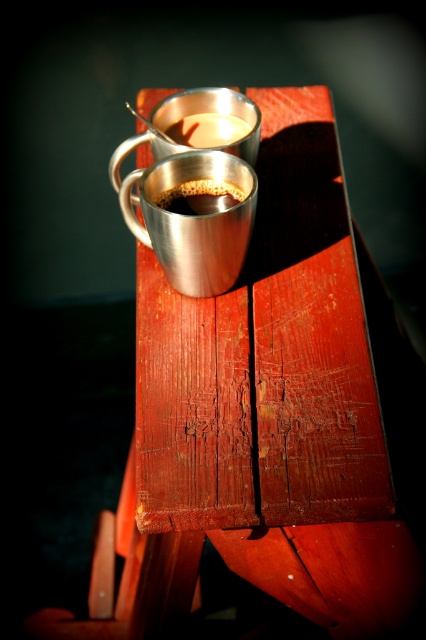
Question: Among these points, which one is nearest to the camera?

Choices:
 (A) (219, 218)
 (B) (222, 131)
 (C) (299, 467)
 (D) (178, 189)

Answer: (C)

Question: Does metallic silver cup at upper center appear on the right side of shiny metallic cup at center?

Choices:
 (A) yes
 (B) no

Answer: (A)

Question: Which point appears farthest from the camera in this image?

Choices:
 (A) (192, 124)
 (B) (164, 248)
 (C) (184, 192)
 (D) (143, 435)

Answer: (A)

Question: Is shiny metallic mug at center smaller than shiny metallic cup at center?

Choices:
 (A) yes
 (B) no

Answer: (B)

Question: Which object is the closest to the metallic silver cup at upper center?

Choices:
 (A) shiny metallic mug at center
 (B) metallic polished table at center

Answer: (A)

Question: Is metallic polished table at center wider than metallic silver cup at upper center?

Choices:
 (A) no
 (B) yes

Answer: (B)